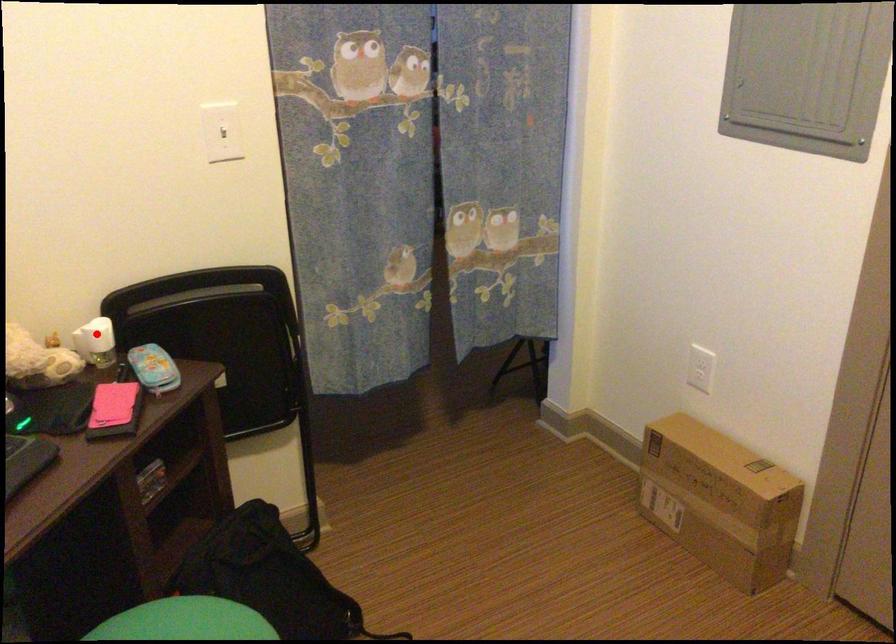
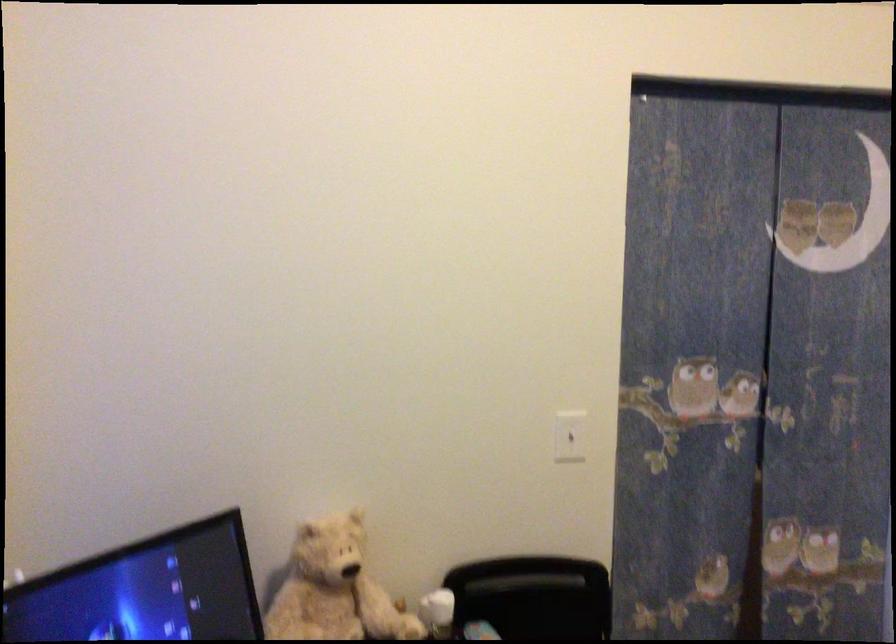
The point at the highlighted location is marked in the first image. Where is the corresponding point in the second image?

(437, 612)